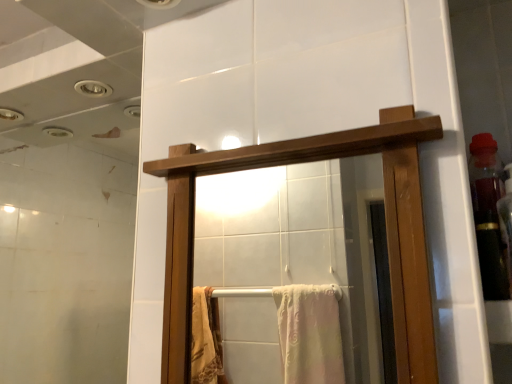
What do you see at coordinates (488, 215) in the screenshot? This screenshot has width=512, height=384. I see `transparent plastic bottle at right` at bounding box center [488, 215].

Image resolution: width=512 pixels, height=384 pixels. In order to click on transparent plastic bottle at right in this screenshot , I will do `click(488, 215)`.

Find the location of `transparent plastic bottle at right`. transparent plastic bottle at right is located at coordinates coord(488,215).